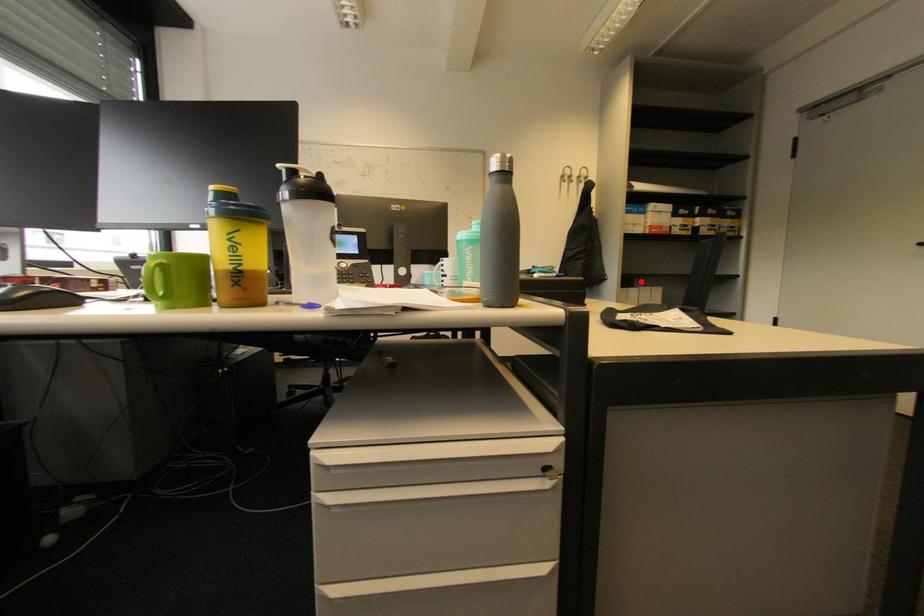
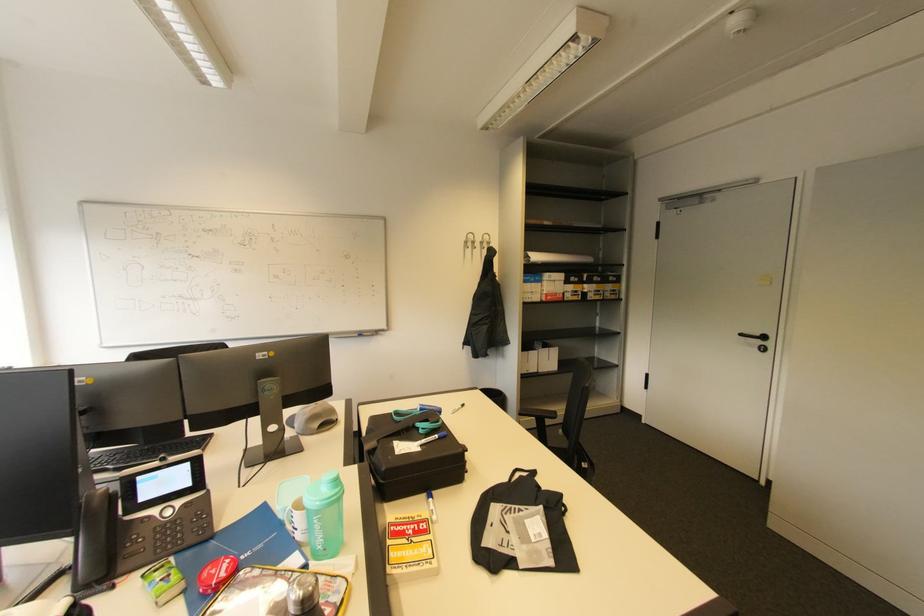
In the second image, find the point that corresponds to the highlighted location in the first image.

(541, 342)